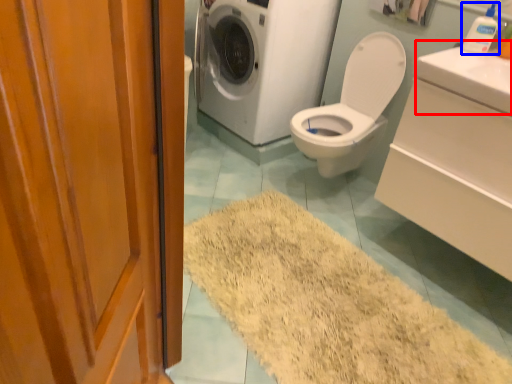
Question: Which object is closer to the camera taking this photo, counter top (highlighted by a red box) or toiletry (highlighted by a blue box)?

Choices:
 (A) counter top
 (B) toiletry

Answer: (A)